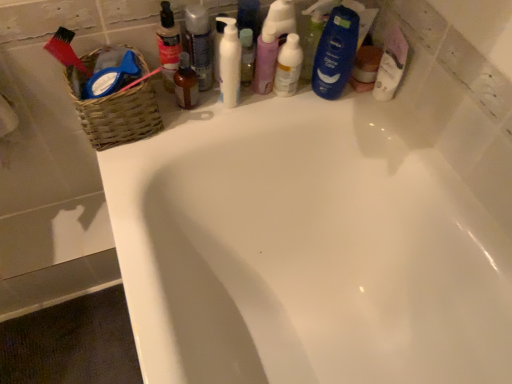
This screenshot has width=512, height=384. Identify the location of spots to the right of brown glass bottle at upper center, the second toiletry from the left. (242, 104).